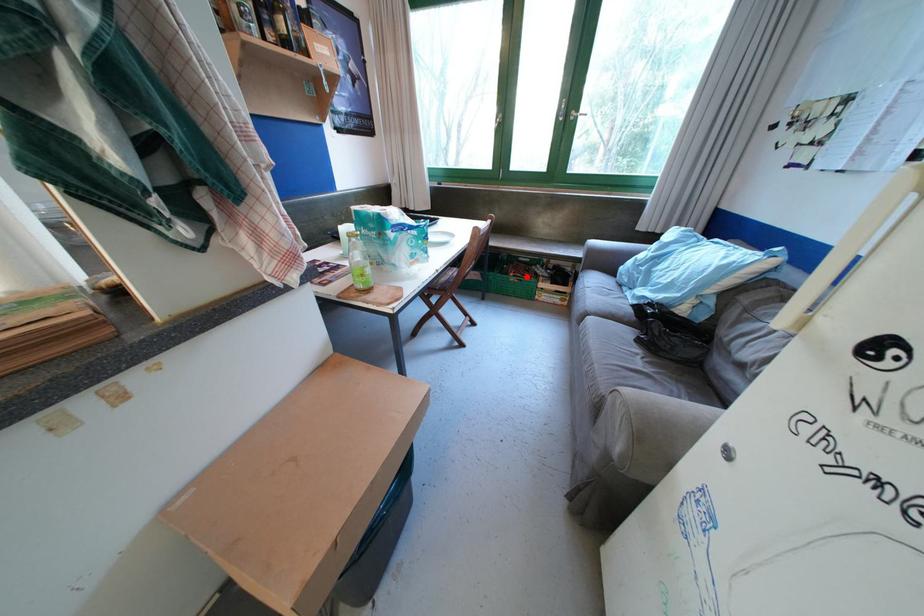
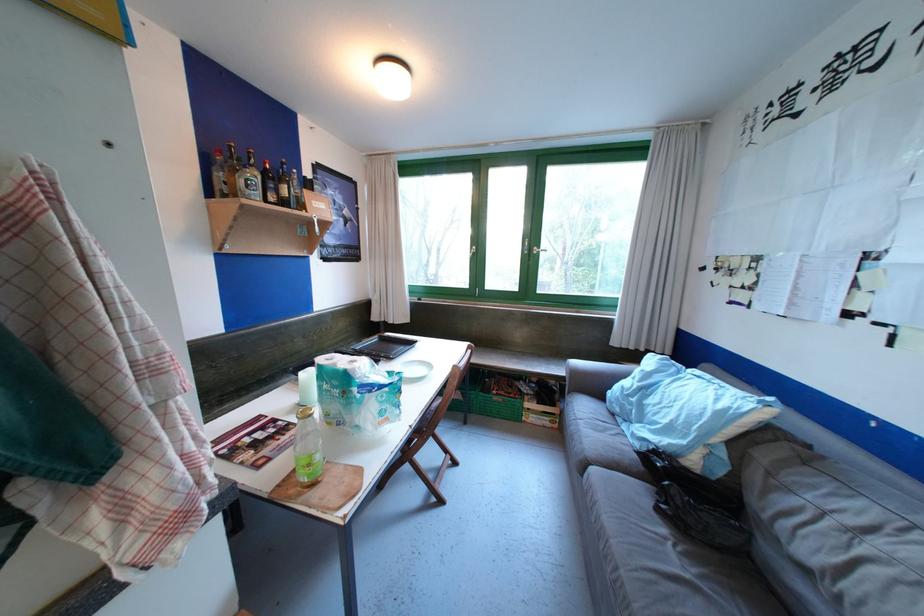
Locate, in the second image, the point that corresponds to the highlighted location in the first image.

(509, 394)